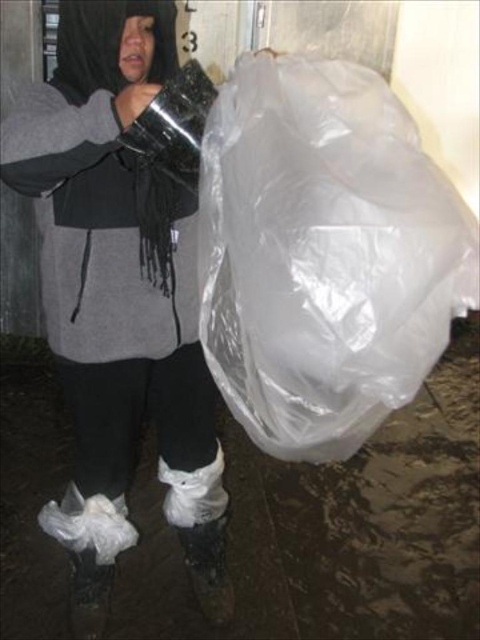
Measure the distance between transparent plastic bag at right and camera.

The distance of transparent plastic bag at right from camera is 3.37 feet.

Looking at this image, is transparent plastic bag at right smaller than transparent plastic bag at upper right?

Indeed, transparent plastic bag at right has a smaller size compared to transparent plastic bag at upper right.

Where is `transparent plastic bag at right`? The width and height of the screenshot is (480, 640). transparent plastic bag at right is located at coordinates (324, 253).

At what (x,y) coordinates should I click in order to perform the action: click on transparent plastic bag at right. Please return your answer as a coordinate pair (x, y). The image size is (480, 640). Looking at the image, I should click on (324, 253).

What do you see at coordinates (324, 253) in the screenshot? I see `transparent plastic bag at right` at bounding box center [324, 253].

Based on the photo, is transparent plastic bag at right shorter than white matte boot at lower center?

No, transparent plastic bag at right is not shorter than white matte boot at lower center.

In the scene shown: Who is more distant from viewer, (398, 384) or (205, 547)?

Positioned behind is point (205, 547).

Where is `transparent plastic bag at right`? This screenshot has width=480, height=640. transparent plastic bag at right is located at coordinates (324, 253).

Who is shorter, transparent plastic bag at upper right or white matte boot at lower center?

Standing shorter between the two is white matte boot at lower center.

Does transparent plastic bag at upper right have a greater width compared to white matte boot at lower center?

Yes, transparent plastic bag at upper right is wider than white matte boot at lower center.

Which is behind, point (216, 586) or point (202, 476)?

Positioned behind is point (216, 586).

The image size is (480, 640). Find the location of `transparent plastic bag at upper right`. transparent plastic bag at upper right is located at coordinates (119, 298).